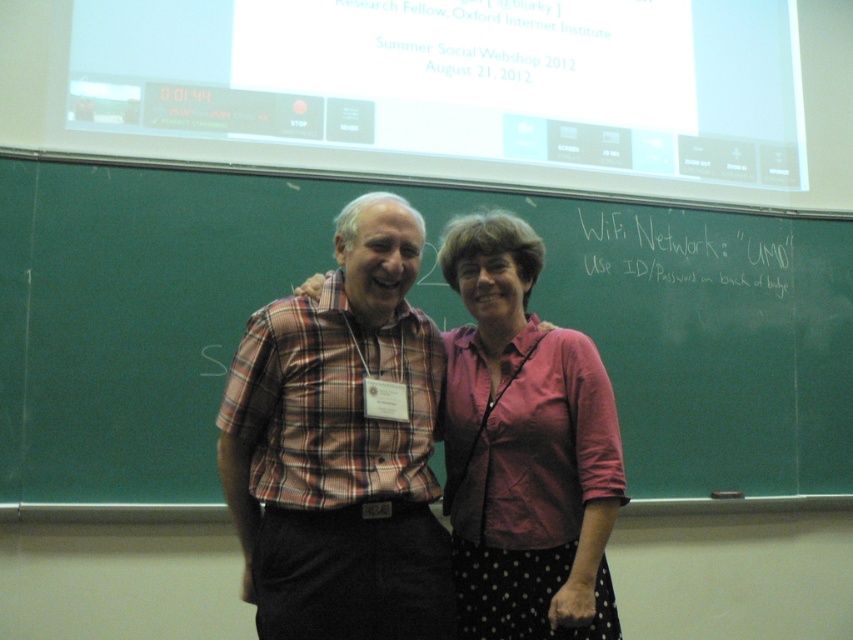
Question: Is green chalkboard at center to the left of pink fabric shirt at center from the viewer's perspective?

Choices:
 (A) yes
 (B) no

Answer: (A)

Question: Based on their relative distances, which object is nearer to the green chalkboard at center?

Choices:
 (A) plaid shirt at center
 (B) pink fabric shirt at center

Answer: (A)

Question: In this image, where is plaid shirt at center located relative to pink fabric shirt at center?

Choices:
 (A) right
 (B) left

Answer: (B)

Question: Which of the following is the farthest from the observer?

Choices:
 (A) green chalkboard at center
 (B) pink fabric shirt at center
 (C) plaid shirt at center

Answer: (A)

Question: Can you confirm if plaid shirt at center is smaller than pink fabric shirt at center?

Choices:
 (A) yes
 (B) no

Answer: (B)

Question: Which of the following is the closest to the observer?

Choices:
 (A) (560, 433)
 (B) (723, 376)

Answer: (A)